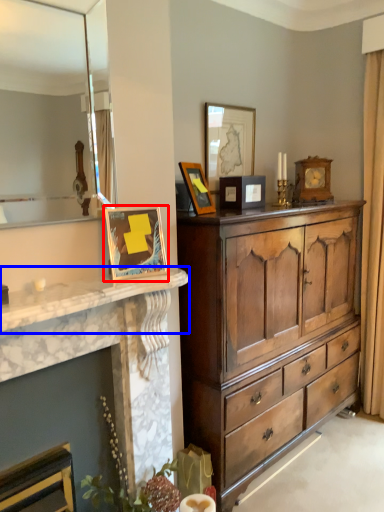
Question: Which of the following is the farthest to the observer, picture frame (highlighted by a red box) or countertop (highlighted by a blue box)?

Choices:
 (A) picture frame
 (B) countertop

Answer: (A)